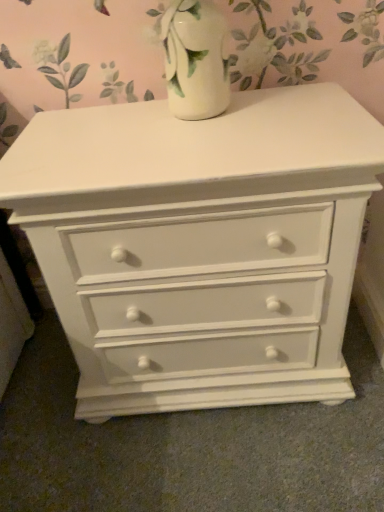
Image resolution: width=384 pixels, height=512 pixels. What do you see at coordinates (200, 245) in the screenshot?
I see `white painted wood chest of drawers at center` at bounding box center [200, 245].

In order to click on white painted wood chest of drawers at center in this screenshot , I will do `click(200, 245)`.

At what (x,y) coordinates should I click in order to perform the action: click on white painted wood chest of drawers at center. Please return your answer as a coordinate pair (x, y). The height and width of the screenshot is (512, 384). Looking at the image, I should click on (200, 245).